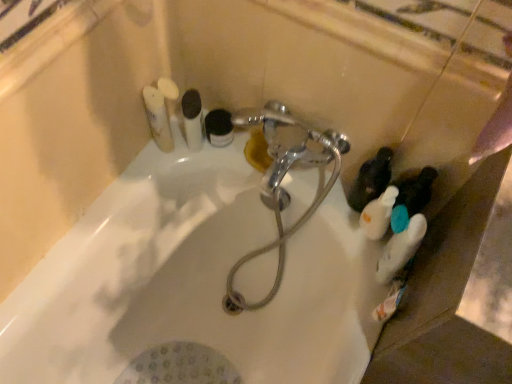
Question: Would you say white matte bottle at lower right contains chrome metallic faucet at center?

Choices:
 (A) no
 (B) yes

Answer: (A)

Question: Is white matte bottle at lower right taller than chrome metallic faucet at center?

Choices:
 (A) yes
 (B) no

Answer: (B)

Question: Considering the relative positions of white matte bottle at lower right and chrome metallic faucet at center in the image provided, is white matte bottle at lower right to the left of chrome metallic faucet at center from the viewer's perspective?

Choices:
 (A) yes
 (B) no

Answer: (B)

Question: Is white matte bottle at lower right not close to chrome metallic faucet at center?

Choices:
 (A) no
 (B) yes

Answer: (A)

Question: Does white matte bottle at lower right have a smaller size compared to chrome metallic faucet at center?

Choices:
 (A) no
 (B) yes

Answer: (B)

Question: From a real-world perspective, is black matte jar at upper center, the 4th toiletry from the left, positioned above or below white matte toothbrushes at upper left, arranged as the 5th toiletry when viewed from the right?

Choices:
 (A) above
 (B) below

Answer: (B)

Question: Looking at their shapes, would you say black matte jar at upper center, the 4th toiletry from the left, is wider or thinner than white matte toothbrushes at upper left, arranged as the 5th toiletry when viewed from the right?

Choices:
 (A) wide
 (B) thin

Answer: (B)

Question: Considering the positions of black matte jar at upper center, marked as the 3th toiletry in a right-to-left arrangement, and white matte toothbrushes at upper left, which is the second toiletry from left to right, in the image, is black matte jar at upper center, marked as the 3th toiletry in a right-to-left arrangement, taller or shorter than white matte toothbrushes at upper left, which is the second toiletry from left to right,?

Choices:
 (A) tall
 (B) short

Answer: (B)

Question: From the image's perspective, relative to white matte toothbrushes at upper left, which is the second toiletry from left to right, is black matte jar at upper center, marked as the 3th toiletry in a right-to-left arrangement, above or below?

Choices:
 (A) below
 (B) above

Answer: (A)

Question: Looking at their shapes, would you say matte black bottle at lower right, arranged as the fifth toiletry when viewed from the left, is wider or thinner than white matte bottle at right, the 1th toiletry in the right-to-left sequence?

Choices:
 (A) wide
 (B) thin

Answer: (B)

Question: In the image, is matte black bottle at lower right, arranged as the fifth toiletry when viewed from the left, positioned in front of or behind white matte bottle at right, which is the sixth toiletry from left to right?

Choices:
 (A) behind
 (B) front

Answer: (A)

Question: Visually, is matte black bottle at lower right, which is counted as the 2th toiletry, starting from the right, positioned to the left or to the right of white matte bottle at right, the 1th toiletry in the right-to-left sequence?

Choices:
 (A) right
 (B) left

Answer: (B)

Question: Considering the positions of point (369, 165) and point (387, 195), is point (369, 165) closer or farther from the camera than point (387, 195)?

Choices:
 (A) farther
 (B) closer

Answer: (A)

Question: From the image's perspective, is white matte toothpaste tube at upper left, arranged as the first toiletry when viewed from the left, positioned above or below chrome metallic faucet at center?

Choices:
 (A) above
 (B) below

Answer: (A)

Question: Is point (170, 134) positioned closer to the camera than point (264, 198)?

Choices:
 (A) closer
 (B) farther

Answer: (A)